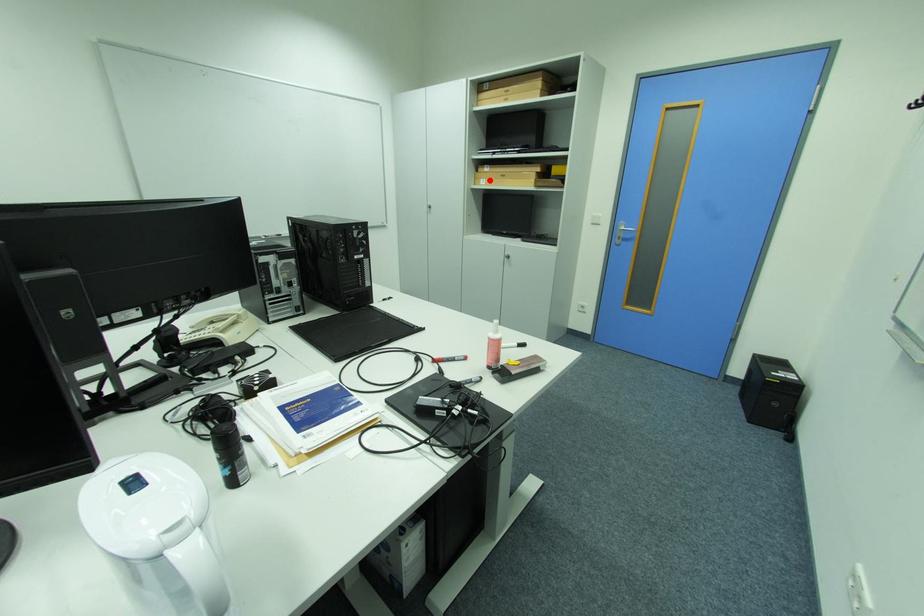
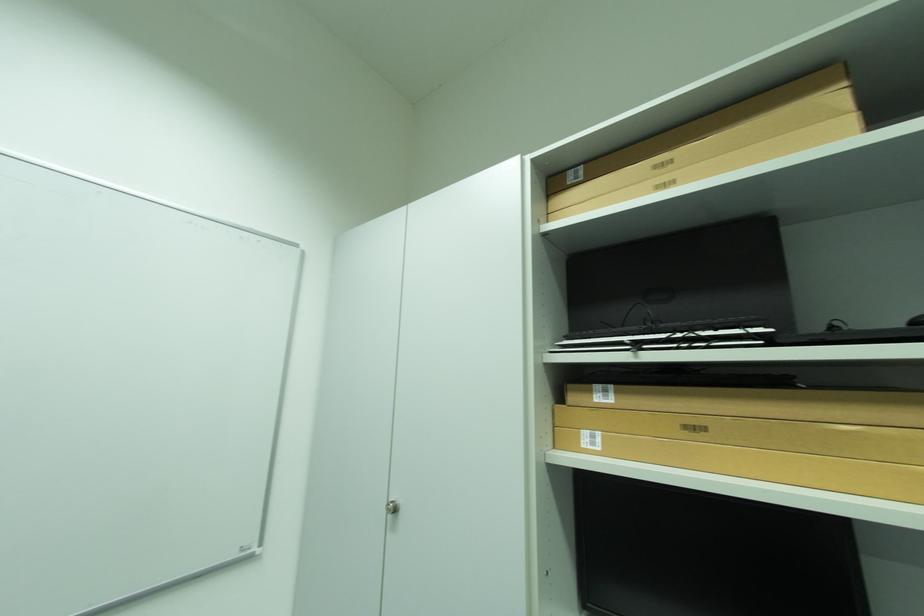
Where in the second image is the point corresponding to the highlighted location from the first image?

(593, 434)